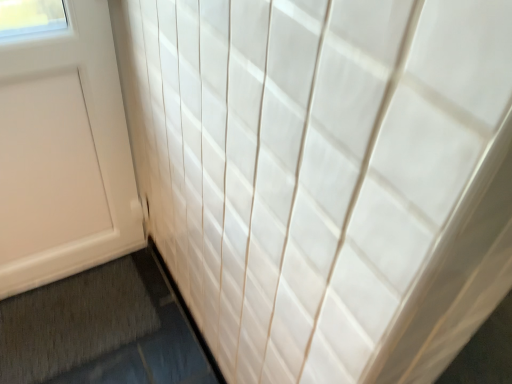
Question: Can you confirm if white matte door at left is thinner than gray textured bath mat at lower left?

Choices:
 (A) yes
 (B) no

Answer: (A)

Question: Is white matte door at left aimed at gray textured bath mat at lower left?

Choices:
 (A) yes
 (B) no

Answer: (A)

Question: Is white matte door at left shorter than gray textured bath mat at lower left?

Choices:
 (A) no
 (B) yes

Answer: (A)

Question: From a real-world perspective, is white matte door at left on gray textured bath mat at lower left?

Choices:
 (A) no
 (B) yes

Answer: (B)

Question: From the image's perspective, is white matte door at left on top of gray textured bath mat at lower left?

Choices:
 (A) no
 (B) yes

Answer: (B)

Question: Is white matte door at left located outside gray textured bath mat at lower left?

Choices:
 (A) no
 (B) yes

Answer: (B)

Question: From a real-world perspective, is gray textured bath mat at lower left positioned under white matte door at left based on gravity?

Choices:
 (A) yes
 (B) no

Answer: (A)

Question: Does gray textured bath mat at lower left have a lesser height compared to white matte door at left?

Choices:
 (A) no
 (B) yes

Answer: (B)

Question: Is gray textured bath mat at lower left at the left side of white matte door at left?

Choices:
 (A) no
 (B) yes

Answer: (A)

Question: Does gray textured bath mat at lower left have a smaller size compared to white matte door at left?

Choices:
 (A) no
 (B) yes

Answer: (B)

Question: Does gray textured bath mat at lower left have a larger size compared to white matte door at left?

Choices:
 (A) no
 (B) yes

Answer: (A)

Question: From the image's perspective, is gray textured bath mat at lower left over white matte door at left?

Choices:
 (A) no
 (B) yes

Answer: (A)

Question: Relative to white matte door at left, is gray textured bath mat at lower left in front or behind?

Choices:
 (A) front
 (B) behind

Answer: (B)